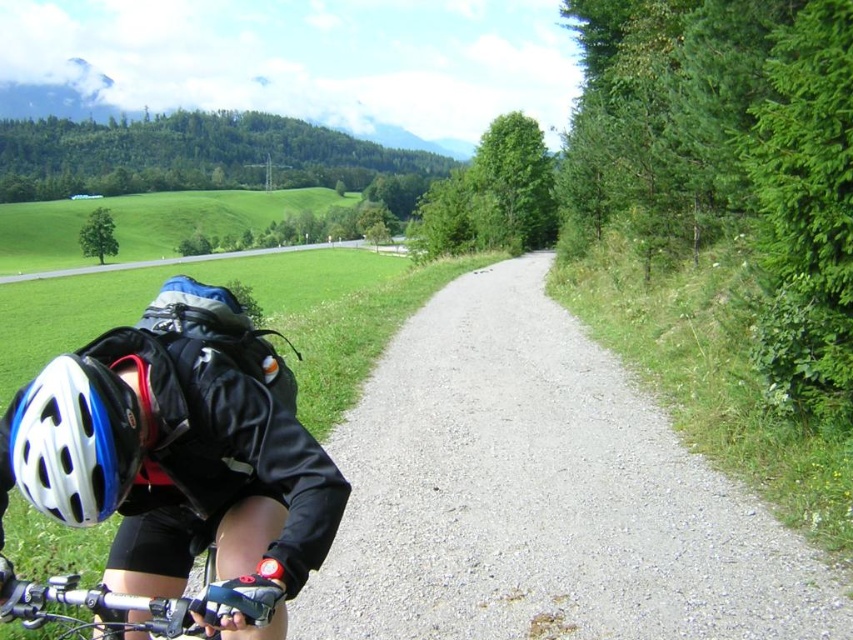
Question: Is the position of gray gravel path at center more distant than that of white matte bicycle helmet at lower left?

Choices:
 (A) no
 (B) yes

Answer: (B)

Question: Is gray gravel path at center positioned behind white matte bicycle helmet at lower left?

Choices:
 (A) no
 (B) yes

Answer: (B)

Question: Is gray gravel path at center further to the viewer compared to white matte bicycle helmet at lower left?

Choices:
 (A) no
 (B) yes

Answer: (B)

Question: Estimate the real-world distances between objects in this image. Which object is farther from the white matte bicycle helmet at lower left?

Choices:
 (A) gray gravel path at center
 (B) black matte gloves at lower center

Answer: (A)

Question: Which point is farther from the camera taking this photo?

Choices:
 (A) (477, 486)
 (B) (96, 600)
 (C) (77, 499)

Answer: (A)

Question: Which is nearer to the white matte bicycle helmet at lower left?

Choices:
 (A) black matte gloves at lower center
 (B) gray gravel path at center

Answer: (A)